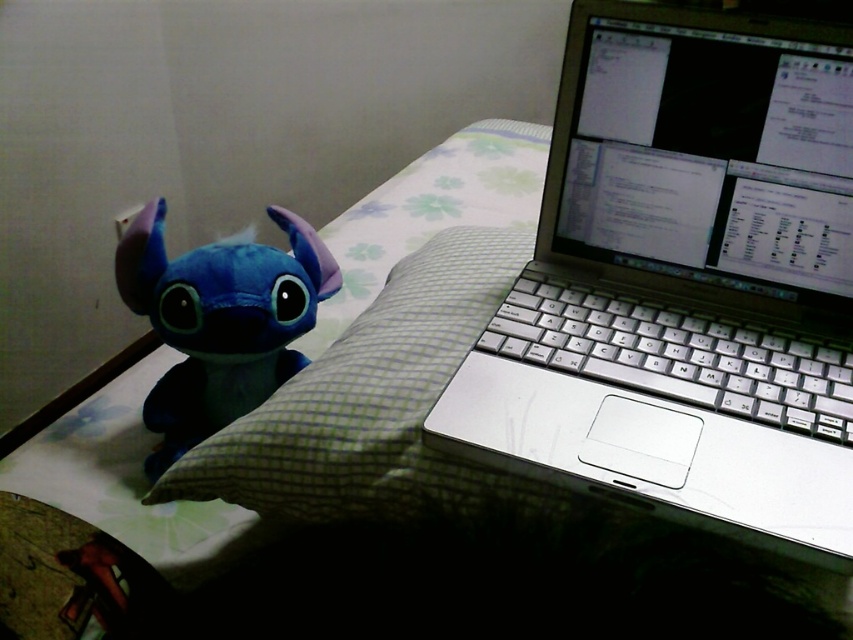
Does silver metallic laptop at upper right have a smaller size compared to soft blue plush at left?

Incorrect, silver metallic laptop at upper right is not smaller in size than soft blue plush at left.

Who is more distant from viewer, [625,19] or [187,400]?

Point [187,400]

I want to click on silver metallic laptop at upper right, so click(x=685, y=280).